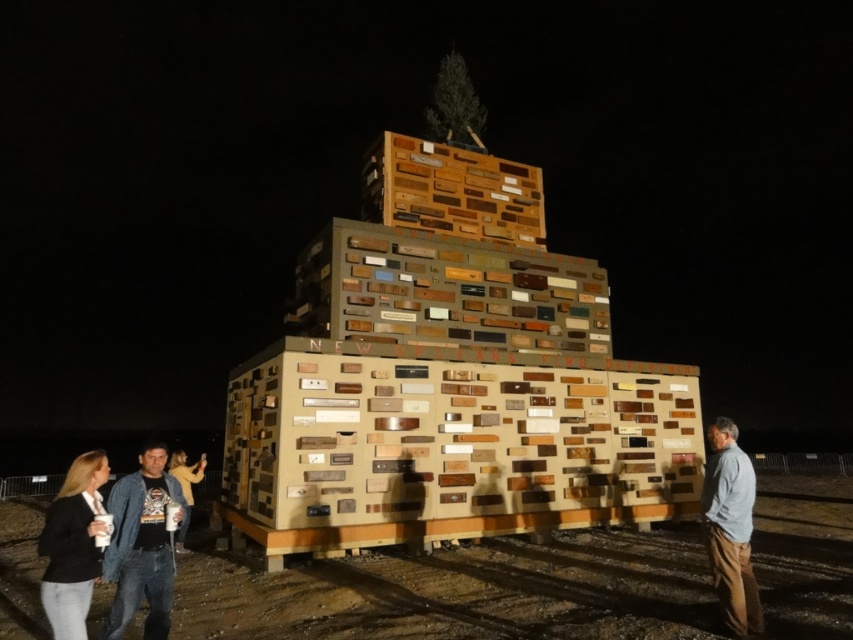
Does denim jacket at lower left have a greater height compared to gray cotton shirt at lower right?

In fact, denim jacket at lower left may be shorter than gray cotton shirt at lower right.

Is point (166, 600) closer to viewer compared to point (724, 598)?

Yes, it is in front of point (724, 598).

Locate an element on the screen. denim jacket at lower left is located at coordinates (141, 545).